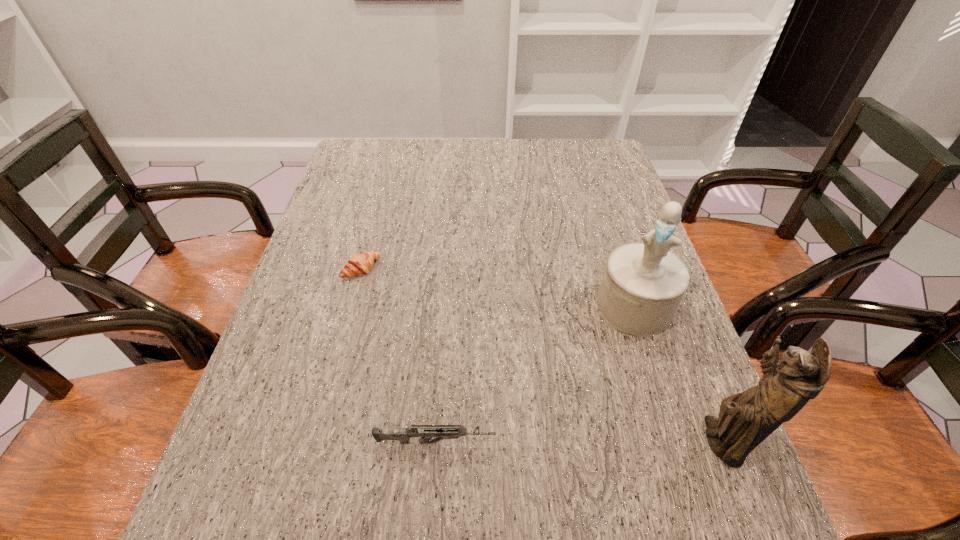
Locate an element on the screen. vacant region that satisfies the following two spatial constraints: 1. on the front side of the pastry; 2. aimed along the barrel of the gun is located at coordinates (317, 442).

This screenshot has width=960, height=540. What are the coordinates of `free space in the image that satisfies the following two spatial constraints: 1. on the front side of the leftmost object; 2. on the front-facing side of the nearer figurine` in the screenshot? It's located at (x=317, y=441).

The width and height of the screenshot is (960, 540). In order to click on vacant area that satisfies the following two spatial constraints: 1. on the front side of the pastry; 2. on the front-facing side of the nearer figurine in this screenshot , I will do coord(317,441).